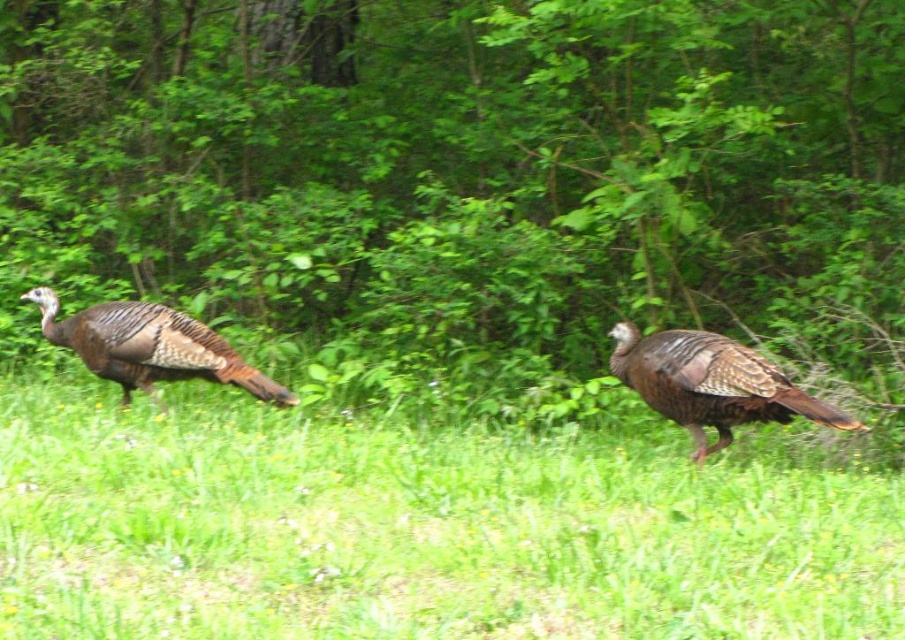
You are a bird flying over a grassy area with small yellow flowers. You see the green leafy tree at center and the green grass at center. Which one is higher from the ground?

The green leafy tree at center is above the green grass at center, so the green leafy tree at center is higher from the ground.

You are standing at the point labeled point (464, 177) in the image. What object is directly in front of you?

The green leafy tree at center is directly in front of you at point (464, 177).